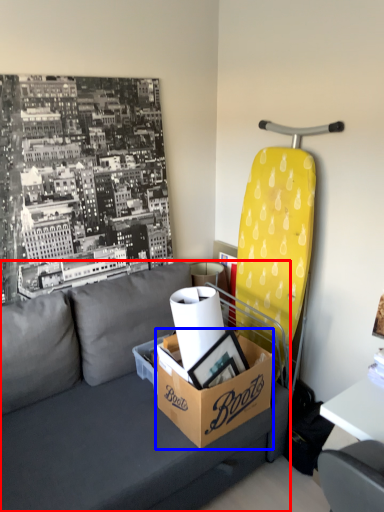
Question: Which point is closer to the camera, studio couch (highlighted by a red box) or box (highlighted by a blue box)?

Choices:
 (A) studio couch
 (B) box

Answer: (A)